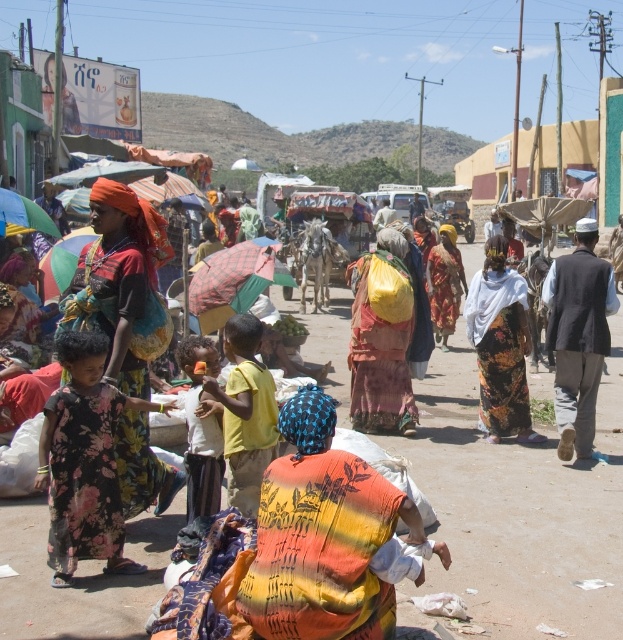
Can you confirm if multicolored fabric bag at center is wider than green fabric umbrella at left?

Incorrect, multicolored fabric bag at center's width does not surpass green fabric umbrella at left's.

Identify the location of multicolored fabric bag at center. (381, 340).

Where is `multicolored fabric bag at center`? This screenshot has width=623, height=640. multicolored fabric bag at center is located at coordinates (381, 340).

Does multicolored fabric bag at center have a greater height compared to floral fabric dress at center?

Indeed, multicolored fabric bag at center has a greater height compared to floral fabric dress at center.

Which is above, multicolored fabric bag at center or floral fabric dress at center?

multicolored fabric bag at center is higher up.

Which is behind, point (402, 420) or point (500, 244)?

The point (402, 420) is behind.

Where is `multicolored fabric bag at center`? The image size is (623, 640). multicolored fabric bag at center is located at coordinates (381, 340).

Does multicolored fabric bag at center have a lesser height compared to checkered fabric umbrella at center?

No, multicolored fabric bag at center is not shorter than checkered fabric umbrella at center.

What do you see at coordinates (381, 340) in the screenshot? The height and width of the screenshot is (640, 623). I see `multicolored fabric bag at center` at bounding box center [381, 340].

I want to click on multicolored fabric bag at center, so click(381, 340).